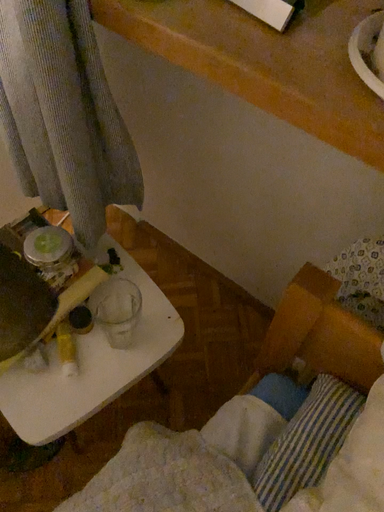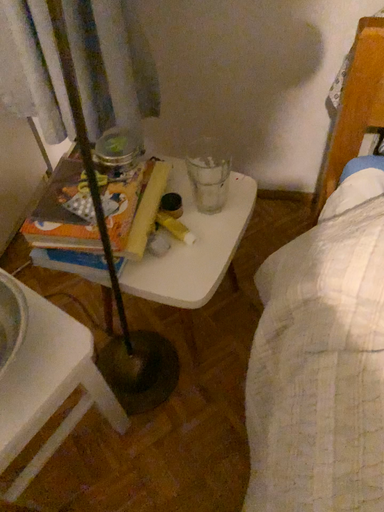
Question: Which way did the camera rotate in the video?

Choices:
 (A) rotated left
 (B) rotated right

Answer: (B)